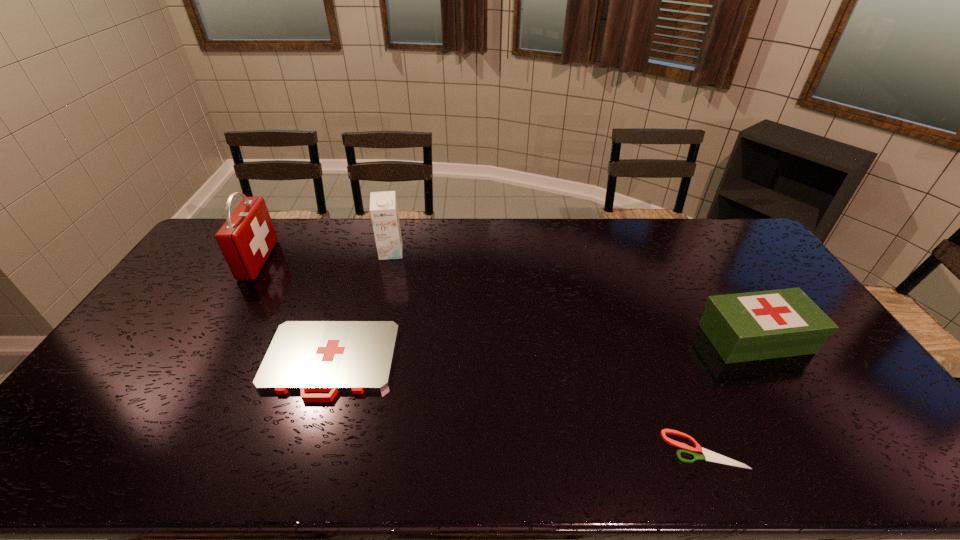
Where is `vacant space located 0.170m on the front of the carton`? The width and height of the screenshot is (960, 540). vacant space located 0.170m on the front of the carton is located at coordinates (381, 293).

You are a GUI agent. You are given a task and a screenshot of the screen. Output one action in this format:
    pyautogui.click(x=<x>, y=<y>)
    Task: Click on the free space located on the front of the rightmost first-aid kit
    The image size is (960, 540).
    Given the screenshot: What is the action you would take?
    pyautogui.click(x=828, y=455)

Identify the location of vacant space positioned on handle side the second shortest object. The width and height of the screenshot is (960, 540). (310, 423).

This screenshot has width=960, height=540. Find the location of `vacant space situated on the back of the second object from right to left`. vacant space situated on the back of the second object from right to left is located at coordinates (654, 325).

Locate an element on the screen. the first-aid kit that is at the far edge is located at coordinates (246, 239).

In order to click on carton that is at the far edge in this screenshot , I will do `click(383, 205)`.

Locate an element on the screen. The width and height of the screenshot is (960, 540). object positioned at the near edge is located at coordinates (708, 455).

In order to click on object at the right edge in this screenshot , I will do `click(760, 325)`.

In the image, there is a desktop. Where is `vacant area at the far edge`? The width and height of the screenshot is (960, 540). vacant area at the far edge is located at coordinates (368, 233).

In the image, there is a desktop. Where is `vacant space at the near edge`? The width and height of the screenshot is (960, 540). vacant space at the near edge is located at coordinates (240, 454).